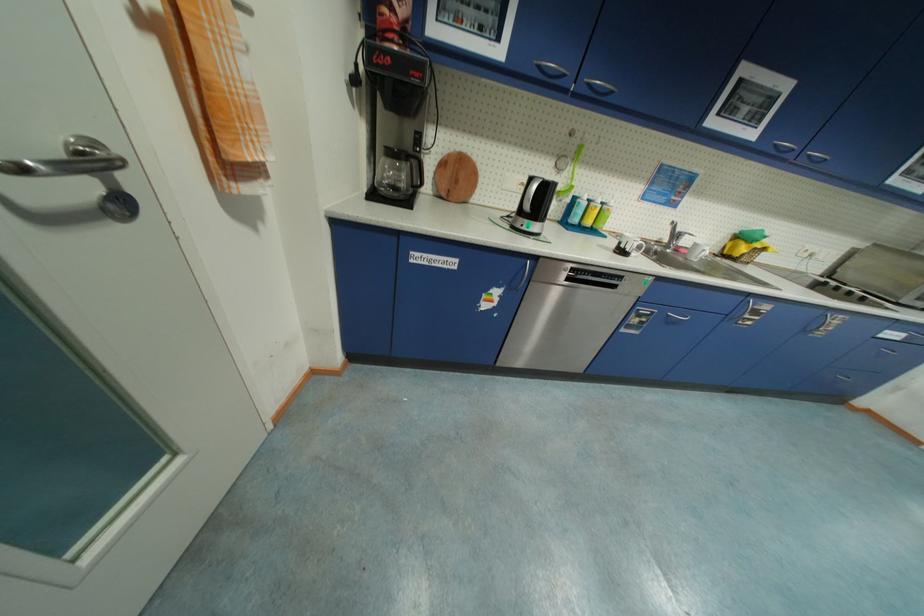
Where would you turn the silver door handle? Please return your answer as a coordinate pair (x, y).

(63, 166)